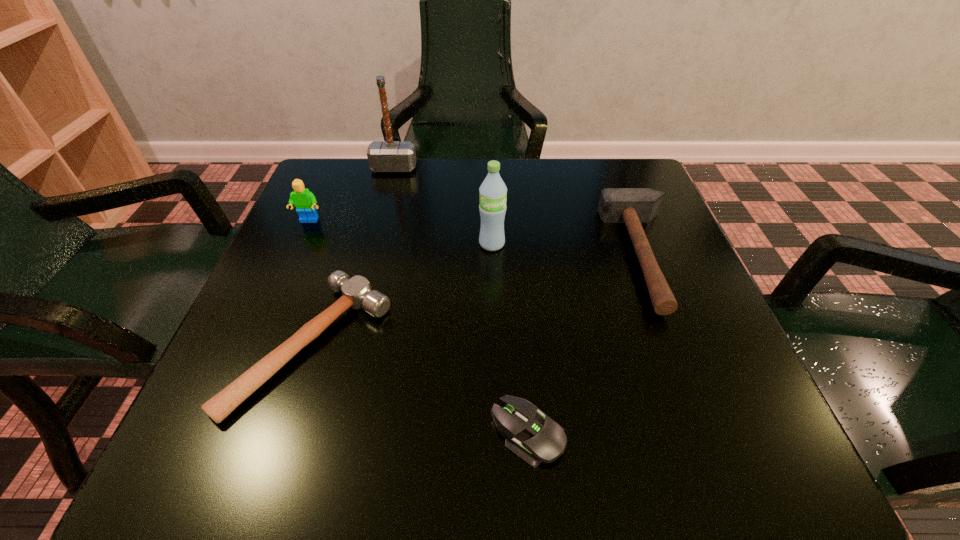
Locate an element on the screen. This screenshot has height=540, width=960. vacant space that's between the shortest object and the second shortest hammer is located at coordinates (587, 345).

What are the coordinates of `free space between the second tallest object and the tallest hammer` in the screenshot? It's located at (443, 206).

At what (x,y) coordinates should I click in order to perform the action: click on vacant point located between the fifth shortest object and the shortest hammer. Please return your answer as a coordinate pair (x, y). This screenshot has height=540, width=960. Looking at the image, I should click on (402, 294).

At what (x,y) coordinates should I click in order to perform the action: click on empty space that is in between the tallest object and the Lego. Please return your answer as a coordinate pair (x, y). This screenshot has width=960, height=540. Looking at the image, I should click on (351, 194).

At what (x,y) coordinates should I click in order to perform the action: click on free space between the computer mouse and the rightmost object. Please return your answer as a coordinate pair (x, y). This screenshot has width=960, height=540. Looking at the image, I should click on (587, 345).

Where is `free space between the second shortest object and the third tallest object`? The height and width of the screenshot is (540, 960). free space between the second shortest object and the third tallest object is located at coordinates (311, 282).

At what (x,y) coordinates should I click in order to perform the action: click on free space between the fourth tallest object and the Lego. Please return your answer as a coordinate pair (x, y). The height and width of the screenshot is (540, 960). Looking at the image, I should click on tap(477, 239).

You are a GUI agent. You are given a task and a screenshot of the screen. Output one action in this format:
    pyautogui.click(x=<x>, y=<y>)
    Task: Click on the vacant space in between the rightmost object and the computer mouse
    The height and width of the screenshot is (540, 960).
    Given the screenshot: What is the action you would take?
    pyautogui.click(x=587, y=345)

This screenshot has width=960, height=540. I want to click on vacant space that's between the rightmost hammer and the water bottle, so click(x=568, y=250).

Where is `object that ranks as the fourth closest to the tallest hammer`? The image size is (960, 540). object that ranks as the fourth closest to the tallest hammer is located at coordinates (632, 206).